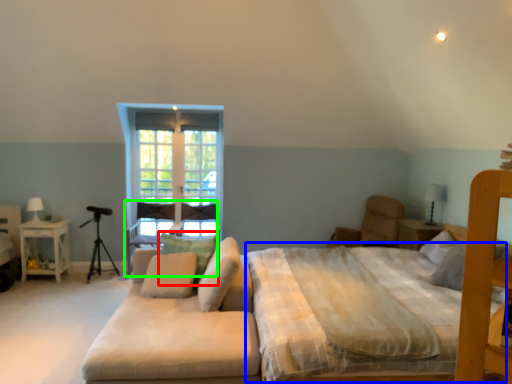
Question: Based on their relative distances, which object is nearer to pillow (highlighted by a red box)? Choose from mattress (highlighted by a blue box) and armchair (highlighted by a green box).

Choices:
 (A) mattress
 (B) armchair

Answer: (A)